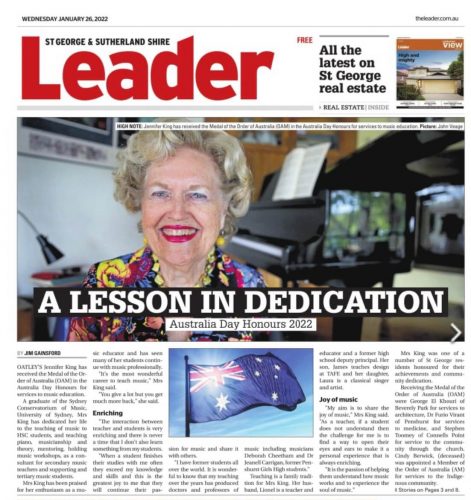
I want to click on piano, so click(x=284, y=222).